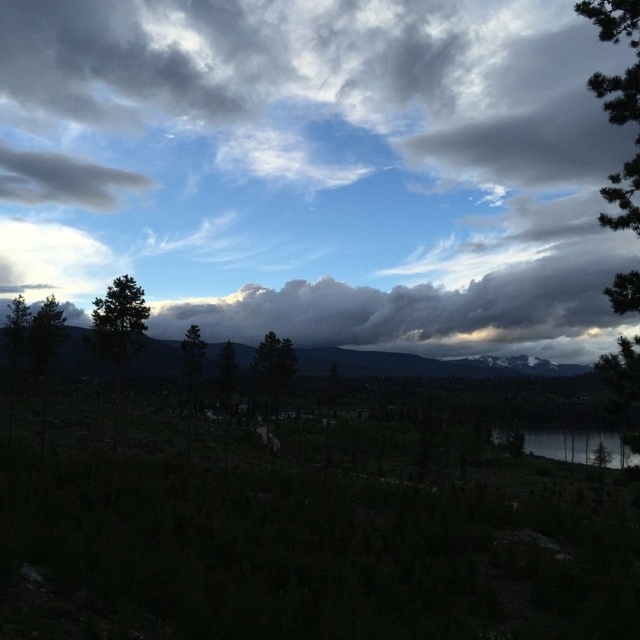
Between cloudy sky at upper center and dark gray rocky mountain at center, which one has less height?

Standing shorter between the two is dark gray rocky mountain at center.

Is cloudy sky at upper center above dark gray rocky mountain at center?

Yes.

This screenshot has width=640, height=640. I want to click on cloudy sky at upper center, so click(x=316, y=170).

Which is below, dark gray rocky mountain at center or green matte tree at left?

dark gray rocky mountain at center is lower down.

From the picture: Is dark gray rocky mountain at center behind green matte tree at left?

Yes, it is.

What do you see at coordinates (428, 364) in the screenshot? The width and height of the screenshot is (640, 640). I see `dark gray rocky mountain at center` at bounding box center [428, 364].

In order to click on dark gray rocky mountain at center in this screenshot , I will do `click(428, 364)`.

Does green textured pine tree at right come behind smooth reflective water at lower right?

Yes, green textured pine tree at right is further from the viewer.

How far apart are green textured pine tree at right and smooth reflective water at lower right?

green textured pine tree at right and smooth reflective water at lower right are 43.11 feet apart from each other.

The height and width of the screenshot is (640, 640). Describe the element at coordinates (618, 104) in the screenshot. I see `green textured pine tree at right` at that location.

Identify the location of green textured pine tree at right. Image resolution: width=640 pixels, height=640 pixels. (618, 104).